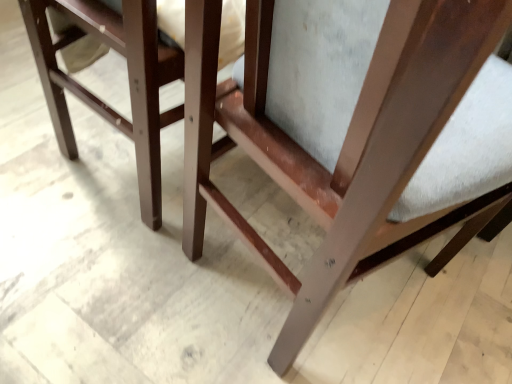
What do you see at coordinates (128, 75) in the screenshot?
I see `matte wood chair at center` at bounding box center [128, 75].

This screenshot has height=384, width=512. What are the coordinates of `matte wood chair at center` in the screenshot? It's located at (128, 75).

Measure the distance between point [208,120] and camera.

Point [208,120] and camera are 59.80 centimeters apart.

Image resolution: width=512 pixels, height=384 pixels. What do you see at coordinates (355, 131) in the screenshot?
I see `matte wood chair at center` at bounding box center [355, 131].

Where is `matte wood chair at center`? This screenshot has height=384, width=512. matte wood chair at center is located at coordinates (355, 131).

The image size is (512, 384). In order to click on matte wood chair at center in this screenshot , I will do `click(128, 75)`.

Considering the positions of objects matte wood chair at center and matte wood chair at center in the image provided, who is more to the left, matte wood chair at center or matte wood chair at center?

matte wood chair at center is more to the left.

Between matte wood chair at center and matte wood chair at center, which one is positioned in front?

matte wood chair at center is in front.

Considering the positions of points (422, 182) and (60, 77), is point (422, 182) farther from camera compared to point (60, 77)?

No, it is not.

From the image's perspective, which is below, matte wood chair at center or matte wood chair at center?

matte wood chair at center is shown below in the image.

From a real-world perspective, who is located lower, matte wood chair at center or matte wood chair at center?

matte wood chair at center is physically lower.

Looking at their sizes, would you say matte wood chair at center is wider or thinner than matte wood chair at center?

matte wood chair at center is wider than matte wood chair at center.

Looking at this image, can you confirm if matte wood chair at center is shorter than matte wood chair at center?

In fact, matte wood chair at center may be taller than matte wood chair at center.

Considering the sizes of objects matte wood chair at center and matte wood chair at center in the image provided, who is smaller, matte wood chair at center or matte wood chair at center?

matte wood chair at center is smaller.

Is matte wood chair at center outside of matte wood chair at center?

Indeed, matte wood chair at center is completely outside matte wood chair at center.

Would you consider matte wood chair at center to be distant from matte wood chair at center?

No, there isn't a large distance between matte wood chair at center and matte wood chair at center.

Is matte wood chair at center aimed at matte wood chair at center?

No, matte wood chair at center is not turned towards matte wood chair at center.

How different are the orientations of matte wood chair at center and matte wood chair at center in degrees?

The angle between the facing direction of matte wood chair at center and the facing direction of matte wood chair at center is 11 degrees.

The height and width of the screenshot is (384, 512). What are the coordinates of `furniture to the left of matte wood chair at center` in the screenshot? It's located at (128, 75).

In the scene shown: Does matte wood chair at center appear on the left side of matte wood chair at center?

Yes.

Is matte wood chair at center behind matte wood chair at center?

Yes, it is.

Does point (134, 5) appear closer or farther from the camera than point (310, 39)?

Clearly, point (134, 5) is more distant from the camera than point (310, 39).

From the image's perspective, who appears lower, matte wood chair at center or matte wood chair at center?

matte wood chair at center, from the image's perspective.

From a real-world perspective, is matte wood chair at center below matte wood chair at center?

Yes, from a real-world perspective, matte wood chair at center is below matte wood chair at center.

Which of these two, matte wood chair at center or matte wood chair at center, is wider?

matte wood chair at center.

Does matte wood chair at center have a lesser height compared to matte wood chair at center?

Yes, matte wood chair at center is shorter than matte wood chair at center.

Which of these two, matte wood chair at center or matte wood chair at center, is bigger?

matte wood chair at center is bigger.

In the scene shown: Is matte wood chair at center spatially inside matte wood chair at center, or outside of it?

matte wood chair at center lies outside matte wood chair at center.

Is the surface of matte wood chair at center in direct contact with matte wood chair at center?

No, matte wood chair at center is not making contact with matte wood chair at center.

Is matte wood chair at center positioned with its back to matte wood chair at center?

No, matte wood chair at center's orientation is not away from matte wood chair at center.

What's the angular difference between matte wood chair at center and matte wood chair at center's facing directions?

The angle between the facing direction of matte wood chair at center and the facing direction of matte wood chair at center is 11 degrees.

How far apart are matte wood chair at center and matte wood chair at center?

9.38 inches.

The height and width of the screenshot is (384, 512). Find the location of `furniture behind the matte wood chair at center`. furniture behind the matte wood chair at center is located at coordinates (128, 75).

Where is `chair below the matte wood chair at center (from the image's perspective)`? The height and width of the screenshot is (384, 512). chair below the matte wood chair at center (from the image's perspective) is located at coordinates (355, 131).

Identify the location of furniture above the matte wood chair at center (from the image's perspective). The height and width of the screenshot is (384, 512). (128, 75).